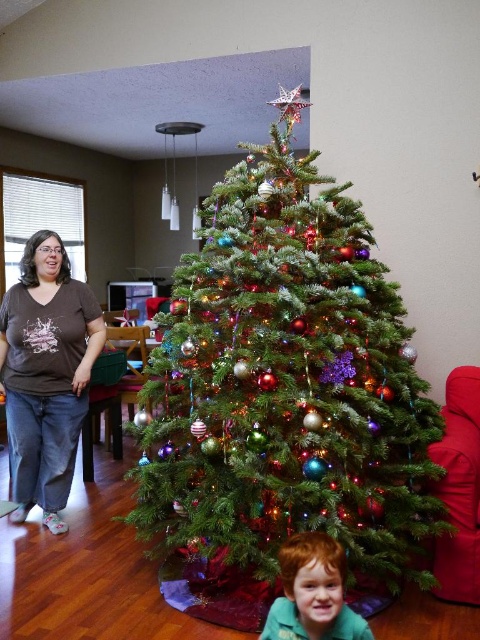
Question: Does brown cotton shirt at left have a lesser width compared to reddish-brown hair boy at lower center?

Choices:
 (A) no
 (B) yes

Answer: (A)

Question: Considering the real-world distances, which object is closest to the reddish-brown hair boy at lower center?

Choices:
 (A) brown cotton shirt at left
 (B) green matte christmas tree at center

Answer: (B)

Question: Which point is farther from the camera taking this photo?

Choices:
 (A) (49, 419)
 (B) (339, 612)
 (C) (210, 259)

Answer: (A)

Question: Is green matte christmas tree at center wider than reddish-brown hair boy at lower center?

Choices:
 (A) no
 (B) yes

Answer: (B)

Question: Which point is closer to the camera taking this photo?

Choices:
 (A) (68, 371)
 (B) (309, 534)
 (C) (345, 205)

Answer: (B)

Question: Can you confirm if brown cotton shirt at left is positioned above reddish-brown hair boy at lower center?

Choices:
 (A) no
 (B) yes

Answer: (B)